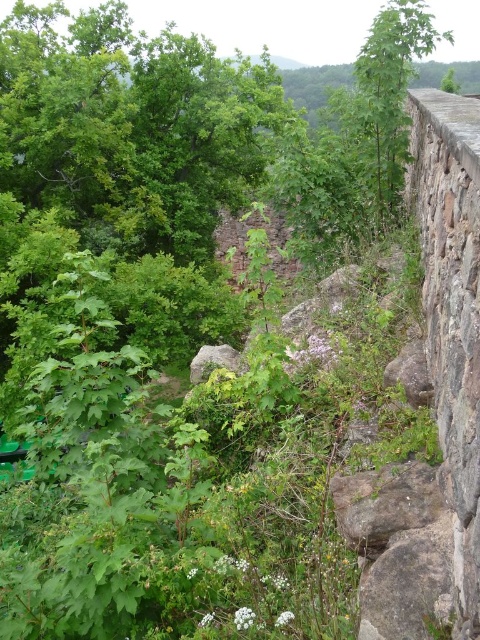
Question: Which object appears closest to the camera in this image?

Choices:
 (A) green leafy tree at upper right
 (B) brown rough rock at center

Answer: (B)

Question: Is gray rough rock at lower right below brown rough rock at center?

Choices:
 (A) yes
 (B) no

Answer: (A)

Question: Which is nearer to the brown rough rock at center?

Choices:
 (A) green leafy tree at upper right
 (B) gray rough rock at lower right

Answer: (B)

Question: Is green leafy tree at upper right thinner than gray rough rock at lower right?

Choices:
 (A) yes
 (B) no

Answer: (B)

Question: Does green leafy tree at upper right appear on the right side of brown rough rock at center?

Choices:
 (A) no
 (B) yes

Answer: (B)

Question: Which point is closer to the camera?

Choices:
 (A) (402, 172)
 (B) (427, 474)

Answer: (B)